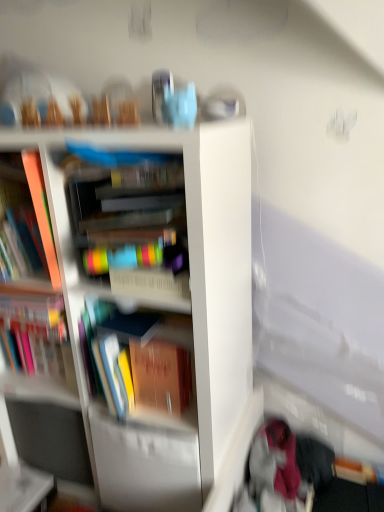
Question: Can you confirm if matte orange book at left, marked as the 3th book in a right-to-left arrangement, is thinner than hardcover book at center, which appears as the third book when viewed from the left?

Choices:
 (A) no
 (B) yes

Answer: (B)

Question: Considering the relative sizes of matte orange book at left, which is the second book from left to right, and hardcover book at center, positioned as the second book in right-to-left order, in the image provided, is matte orange book at left, which is the second book from left to right, taller than hardcover book at center, positioned as the second book in right-to-left order,?

Choices:
 (A) yes
 (B) no

Answer: (B)

Question: Is matte orange book at left, which is the second book from left to right, positioned in front of hardcover book at center, which appears as the third book when viewed from the left?

Choices:
 (A) yes
 (B) no

Answer: (B)

Question: Considering the relative sizes of matte orange book at left, marked as the 3th book in a right-to-left arrangement, and hardcover book at center, which appears as the third book when viewed from the left, in the image provided, is matte orange book at left, marked as the 3th book in a right-to-left arrangement, bigger than hardcover book at center, which appears as the third book when viewed from the left,?

Choices:
 (A) yes
 (B) no

Answer: (B)

Question: Is matte orange book at left, marked as the 3th book in a right-to-left arrangement, smaller than hardcover book at center, positioned as the second book in right-to-left order?

Choices:
 (A) yes
 (B) no

Answer: (A)

Question: Considering their positions, is matte orange book at left, which is the second book from left to right, located in front of or behind hardcover book at left, the fourth book viewed from the right?

Choices:
 (A) front
 (B) behind

Answer: (A)

Question: From the image's perspective, is matte orange book at left, which is the second book from left to right, positioned above or below hardcover book at left, the fourth book viewed from the right?

Choices:
 (A) above
 (B) below

Answer: (A)

Question: Looking at their shapes, would you say matte orange book at left, marked as the 3th book in a right-to-left arrangement, is wider or thinner than hardcover book at left, the fourth book viewed from the right?

Choices:
 (A) thin
 (B) wide

Answer: (B)

Question: Does point (41, 215) appear closer or farther from the camera than point (64, 316)?

Choices:
 (A) closer
 (B) farther

Answer: (A)

Question: Based on their positions, is white glossy bookcase at center located to the left or right of velvet pink scarf at lower right?

Choices:
 (A) right
 (B) left

Answer: (B)

Question: Is point (188, 205) positioned closer to the camera than point (274, 452)?

Choices:
 (A) farther
 (B) closer

Answer: (B)

Question: Considering the positions of white glossy bookcase at center and velvet pink scarf at lower right in the image, is white glossy bookcase at center taller or shorter than velvet pink scarf at lower right?

Choices:
 (A) tall
 (B) short

Answer: (A)

Question: Which is correct: white glossy bookcase at center is inside velvet pink scarf at lower right, or outside of it?

Choices:
 (A) outside
 (B) inside

Answer: (A)

Question: From the image's perspective, relative to multicolored plastic container at center, acting as the 4th book starting from the left, is velvet pink scarf at lower right above or below?

Choices:
 (A) below
 (B) above

Answer: (A)

Question: In terms of height, does velvet pink scarf at lower right look taller or shorter compared to multicolored plastic container at center, which is the first book in right-to-left order?

Choices:
 (A) short
 (B) tall

Answer: (A)